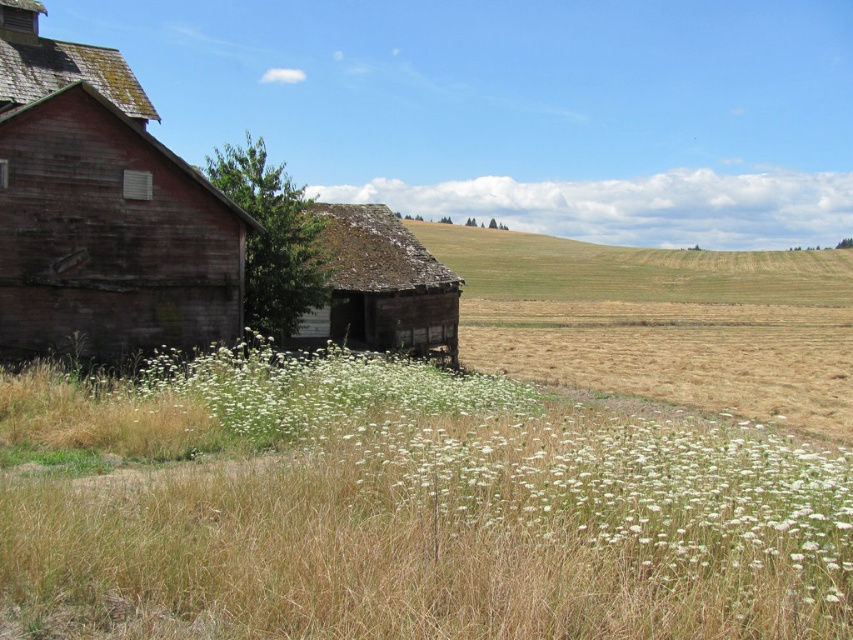
You are standing in the rural landscape and want to take a photo of the rustic wooden barn at left and the rusty wood hut at center. Which structure should you focus on first to ensure both are in the frame without moving the camera?

You should focus on the rustic wooden barn at left first because it is closer to you than the rusty wood hut at center, so keeping it in focus will naturally include the background structure in the frame.

Based on the photo, you are a painter standing in front of the rural landscape. You need to paint the white fluffy flowers at center and the rusty wood hut at center. Which object should you focus on first if you want to paint the taller one first?

The rusty wood hut at center is taller than the white fluffy flowers at center, so you should focus on painting the rusty wood hut at center first.